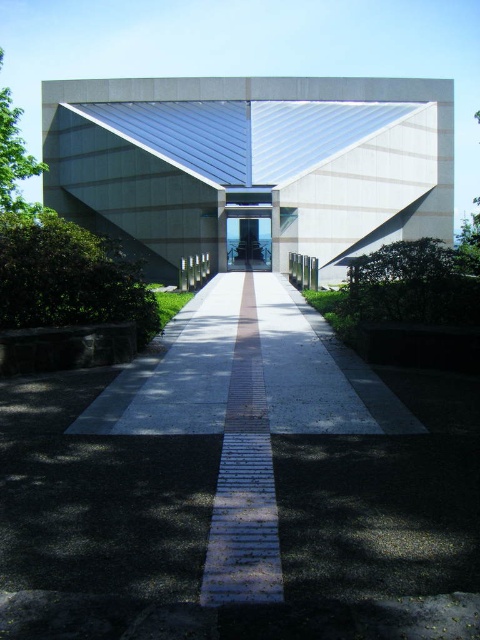
You are standing in front of the modern architectural structure and want to walk towards the entrance. You notice the white smooth concrete corridor at center and the brick paved path at center. Which one is higher in elevation?

The white smooth concrete corridor at center is taller than the brick paved path at center, so the white smooth concrete corridor at center is higher in elevation.

You are standing at the entrance of the building and want to walk towards the triangular roof section. Which path should you take, the white smooth concrete corridor at center or the brick paved path at center, and why?

You should take the white smooth concrete corridor at center because it is above the brick paved path at center, so it might offer a closer or elevated view towards the triangular roof section.